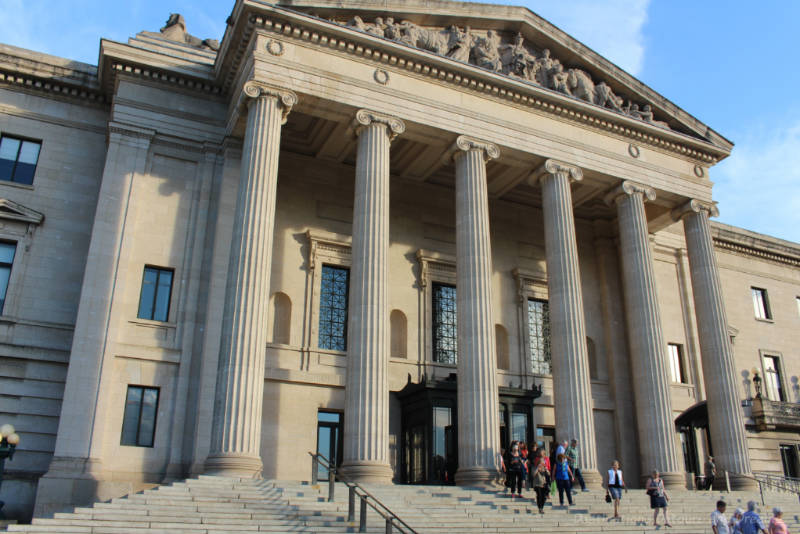
You are a GUI agent. You are given a task and a screenshot of the screen. Output one action in this format:
    pyautogui.click(x=<x>, y=<y>)
    Task: Click on the bottom of pillar
    
    Given the screenshot: What is the action you would take?
    pyautogui.click(x=248, y=463), pyautogui.click(x=366, y=464), pyautogui.click(x=482, y=472), pyautogui.click(x=585, y=473), pyautogui.click(x=674, y=476), pyautogui.click(x=746, y=482)